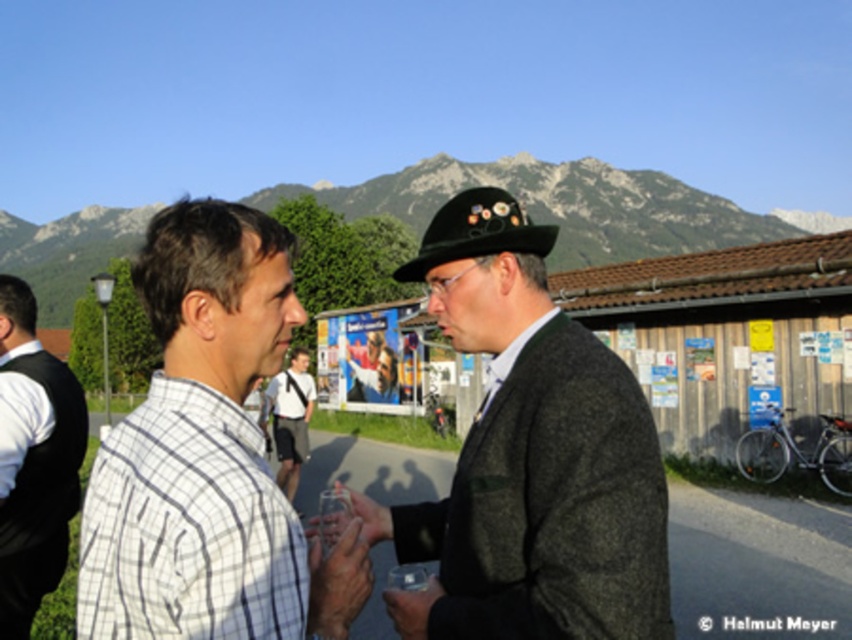
Is white checkered shirt at left to the right of white cotton shirt at center from the viewer's perspective?

Correct, you'll find white checkered shirt at left to the right of white cotton shirt at center.

Can you confirm if white checkered shirt at left is positioned above white cotton shirt at center?

Indeed, white checkered shirt at left is positioned over white cotton shirt at center.

Between point (239, 467) and point (285, 458), which one is positioned in front?

Point (239, 467) is in front.

This screenshot has height=640, width=852. Identify the location of white checkered shirt at left. (208, 456).

Who is more forward, (445,298) or (0,628)?

Point (445,298) is more forward.

Does dark gray woolen hat at center have a greater width compared to white shirt at left?

Incorrect, dark gray woolen hat at center's width does not surpass white shirt at left's.

Which is behind, point (545, 584) or point (14, 445)?

Positioned behind is point (14, 445).

Identify the location of dark gray woolen hat at center. Image resolution: width=852 pixels, height=640 pixels. (528, 456).

Is white checkered shirt at left positioned at the back of white shirt at left?

No, white checkered shirt at left is closer to the viewer.

Find the location of a particular element. white checkered shirt at left is located at coordinates (208, 456).